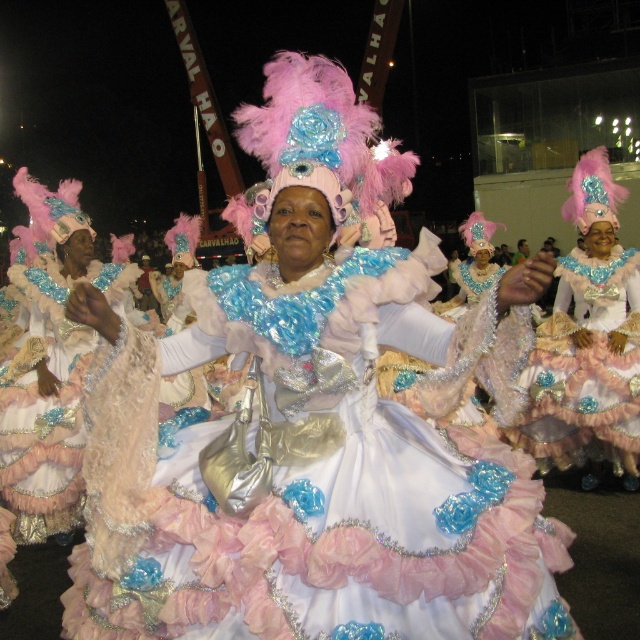
Is point (600, 200) positioned in front of point (70, 484)?

No, it is not.

Is shiny sequined dress at center to the left of frosted lace dress at center from the viewer's perspective?

Incorrect, shiny sequined dress at center is not on the left side of frosted lace dress at center.

Identify the location of shiny sequined dress at center. This screenshot has width=640, height=640. (588, 340).